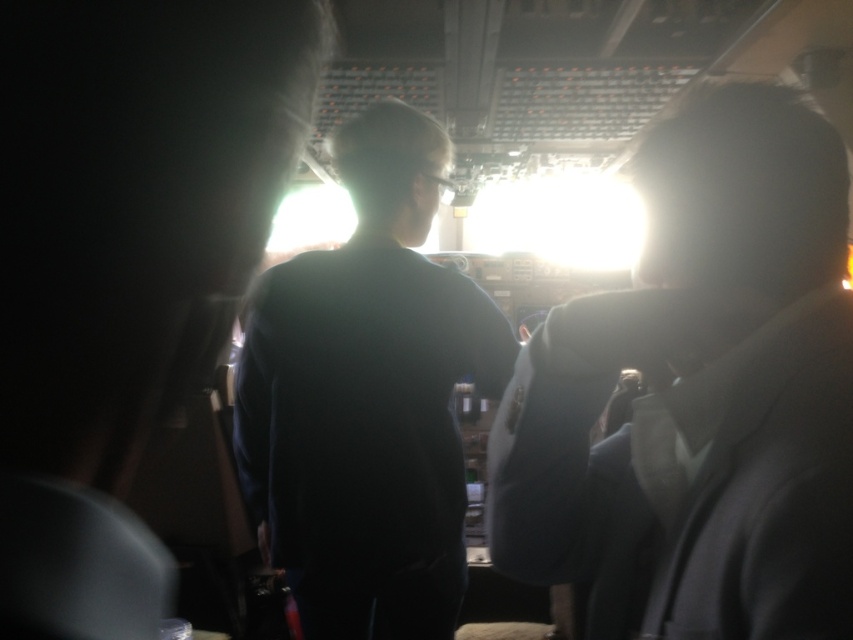
You are a flight attendant checking the seating arrangement in the cockpit area. You notice two passengers wearing matte black jacket at center and dark matte shirt at center. Which passenger is sitting closer to the cockpit door?

The matte black jacket at center is closer to the viewer than the dark matte shirt at center, so the passenger wearing the matte black jacket at center is sitting closer to the cockpit door.

You are a flight attendant checking the height of passengers in the cockpit area. You see the dark gray suit at right and the dark matte shirt at center. Which passenger is shorter?

The dark gray suit at right is shorter than the dark matte shirt at center because it is not as tall as the dark matte shirt at center.